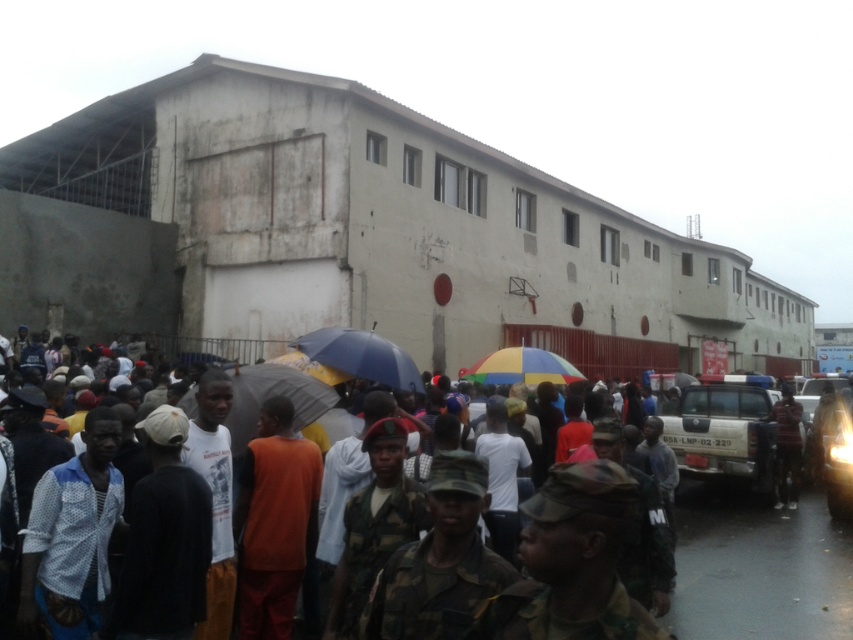
You are a photographer at the event and want to capture both the camouflage uniform at center and the blue matte umbrella at center in a single frame. Given their sizes, which object should you focus on to ensure both are clearly visible in the photo?

The camouflage uniform at center is smaller than the blue matte umbrella at center. To ensure both are clearly visible, focus on the camouflage uniform at center since it is smaller and requires more attention to detail.